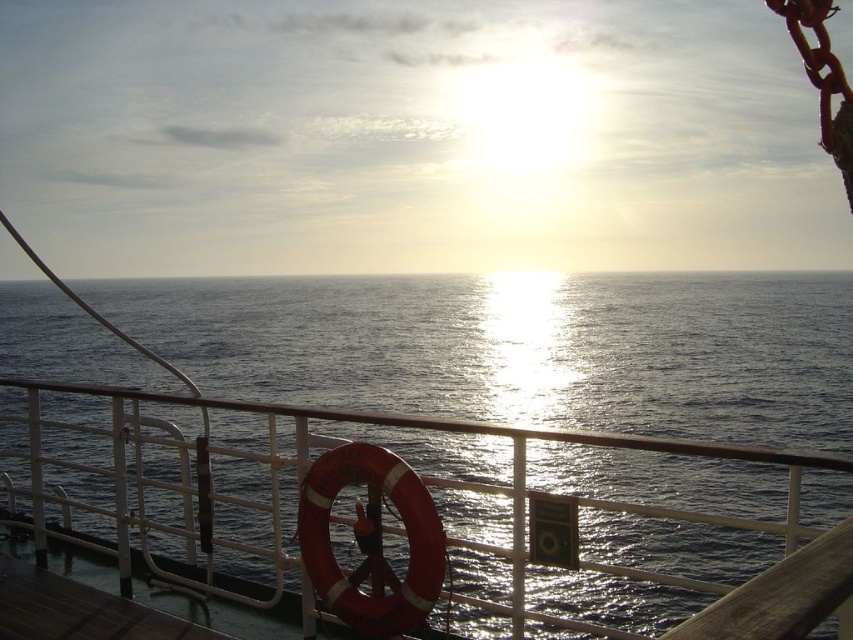
Does glistening water at center have a greater width compared to brown wooden deck at lower left?

Yes, glistening water at center is wider than brown wooden deck at lower left.

The height and width of the screenshot is (640, 853). What do you see at coordinates (523, 348) in the screenshot?
I see `glistening water at center` at bounding box center [523, 348].

The image size is (853, 640). What are the coordinates of `glistening water at center` in the screenshot? It's located at (523, 348).